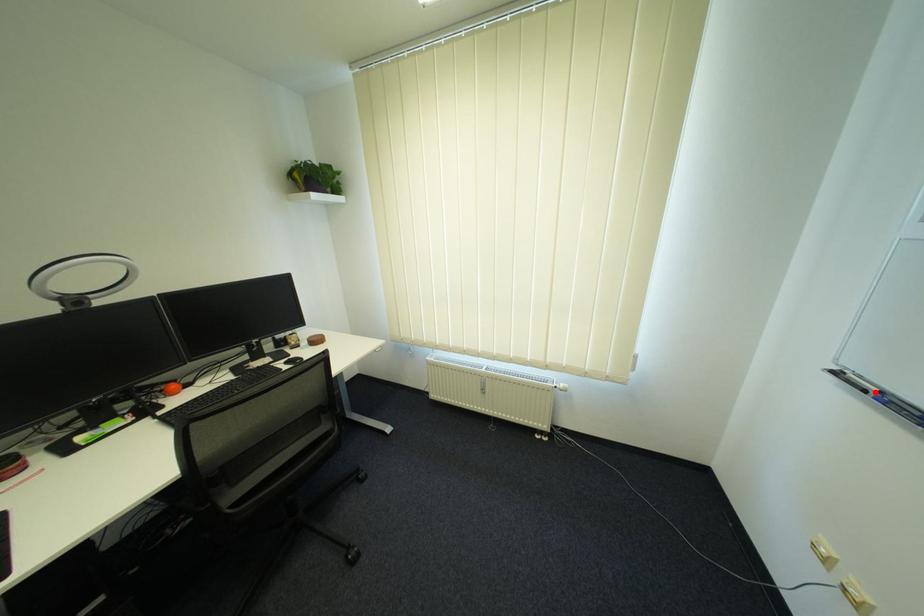
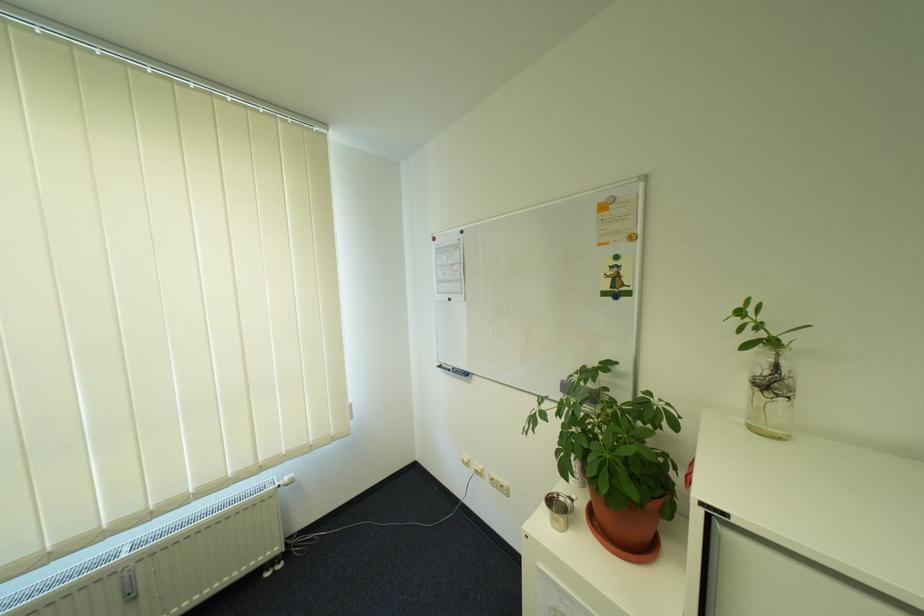
In the second image, find the point that corresponds to the highlighted location in the first image.

(458, 371)